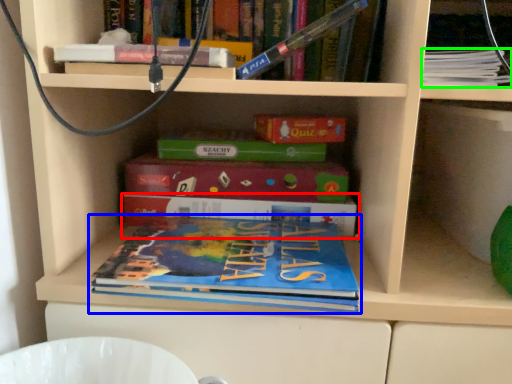
Question: Considering the real-world distances, which object is closest to book (highlighted by a red box)? book (highlighted by a blue box) or book (highlighted by a green box).

Choices:
 (A) book
 (B) book

Answer: (A)